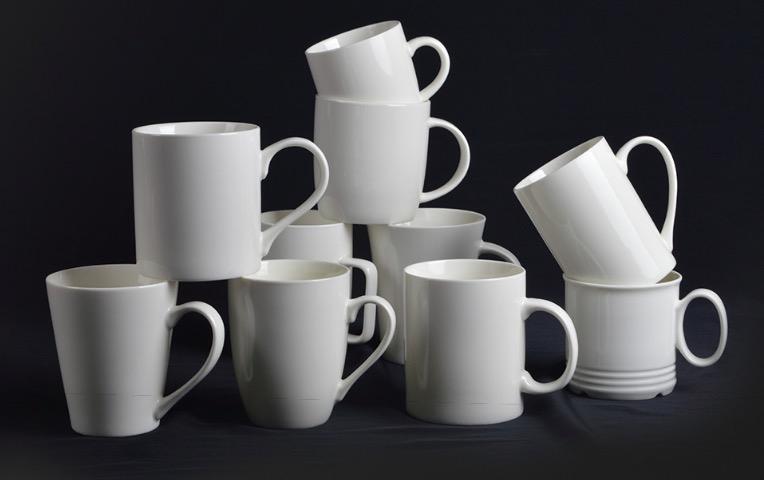
Image resolution: width=764 pixels, height=480 pixels. In order to click on mugs in this screenshot , I will do `click(619, 189)`, `click(649, 343)`, `click(448, 347)`, `click(379, 66)`, `click(299, 224)`, `click(476, 245)`, `click(206, 193)`, `click(105, 345)`, `click(292, 354)`.